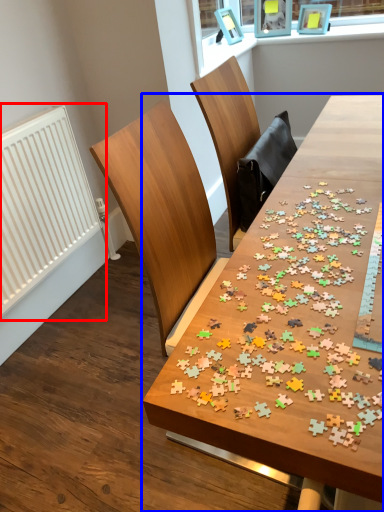
Question: Which object appears closest to the camera in this image, radiator (highlighted by a red box) or table (highlighted by a blue box)?

Choices:
 (A) radiator
 (B) table

Answer: (B)